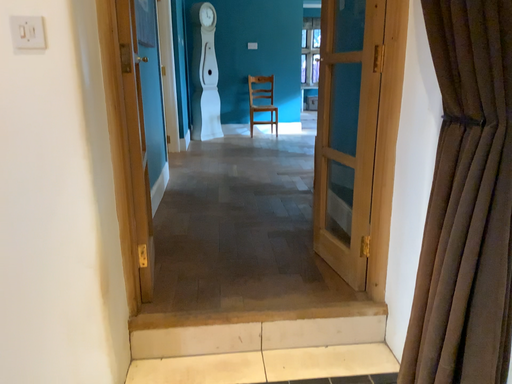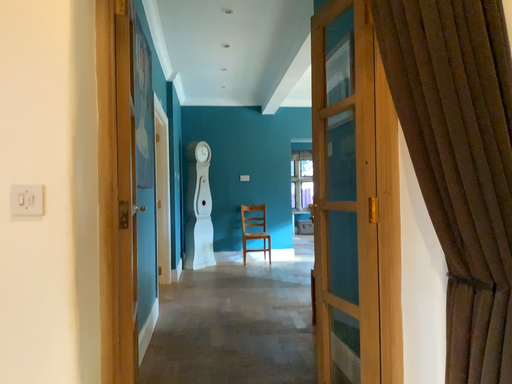
Question: How did the camera likely rotate when shooting the video?

Choices:
 (A) rotated downward
 (B) rotated upward

Answer: (B)